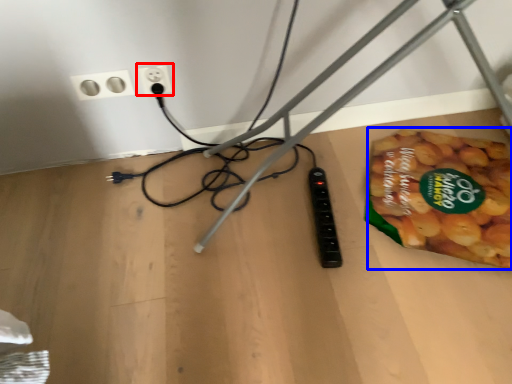
Question: Which object appears closest to the camera in this image, power plugs and sockets (highlighted by a red box) or food (highlighted by a blue box)?

Choices:
 (A) power plugs and sockets
 (B) food

Answer: (B)